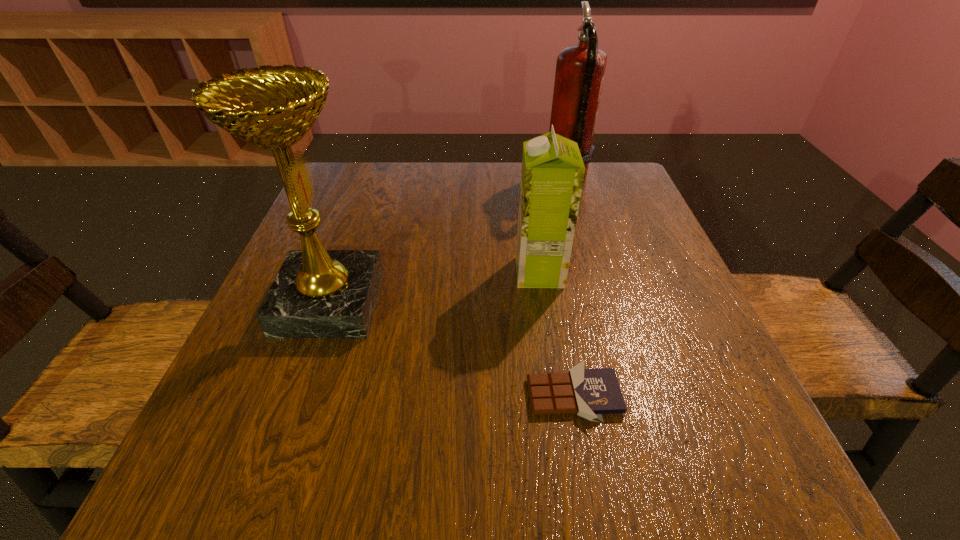
Where is `the farthest object`? The width and height of the screenshot is (960, 540). the farthest object is located at coordinates (580, 69).

The height and width of the screenshot is (540, 960). Identify the location of the leftmost object. (317, 293).

Where is `soya milk`? This screenshot has width=960, height=540. soya milk is located at coordinates (552, 174).

At what (x,y) coordinates should I click in order to perform the action: click on chocolate bar. Please return your answer as a coordinate pair (x, y). The width and height of the screenshot is (960, 540). Looking at the image, I should click on (590, 393).

You are a GUI agent. You are given a task and a screenshot of the screen. Output one action in this format:
    pyautogui.click(x=<x>, y=<y>)
    Task: Click on the nearest object
    The width and height of the screenshot is (960, 540).
    Given the screenshot: What is the action you would take?
    pyautogui.click(x=590, y=393)

The height and width of the screenshot is (540, 960). What are the coordinates of `vacant space situated at the nozzle of the fire extinguisher` in the screenshot? It's located at (492, 181).

The height and width of the screenshot is (540, 960). Identify the location of free space located 0.200m at the nozzle of the fire extinguisher. (465, 181).

I want to click on vacant area located 0.180m at the nozzle of the fire extinguisher, so click(472, 181).

Where is `free space located 0.380m on the front-facing side of the leftmost object`? The image size is (960, 540). free space located 0.380m on the front-facing side of the leftmost object is located at coordinates (582, 302).

Where is `vacant area situated on the left of the third tallest object`? Image resolution: width=960 pixels, height=540 pixels. vacant area situated on the left of the third tallest object is located at coordinates (491, 272).